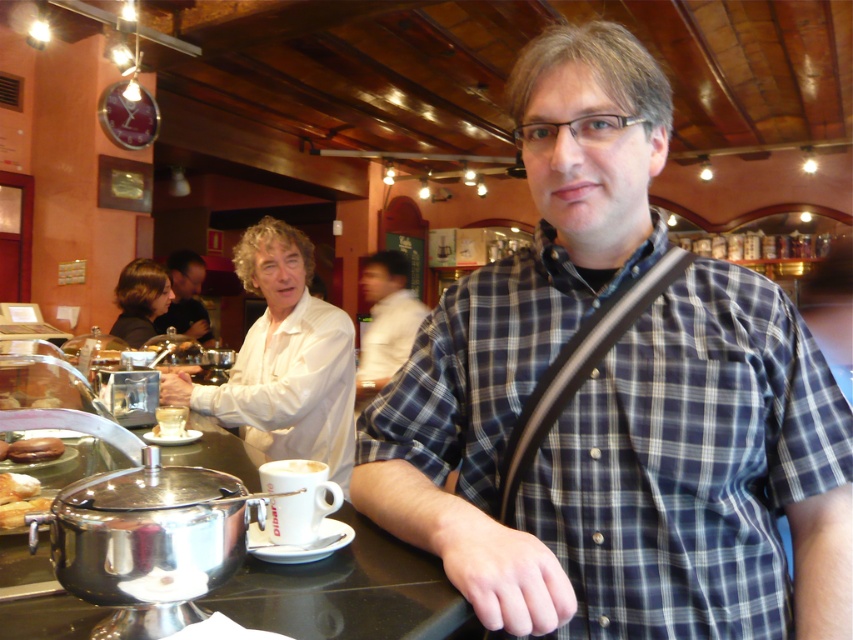
You are a customer at the cozy cafe and want to grab the brown matte pastry at lower left and the matte brown bread at center. Which item is closer to you on the counter?

The brown matte pastry at lower left is closer to you than the matte brown bread at center because it is further to the viewer.

You are a customer at the cafe and want to choose between the brown matte pastry at lower left and the matte brown bread at center. Which one is shorter in height?

The brown matte pastry at lower left is shorter in height than the matte brown bread at center.

You are a customer in the cafe and want to order a drink. The barista is at the counter. Where should you stand relative to the blue plaid shirt at center to be seen clearly by the barista?

To be seen clearly by the barista, you should stand in front of the blue plaid shirt at center since it is positioned at point (x=618, y=403), which is likely the central area of the counter where the barista can easily see and interact with customers.